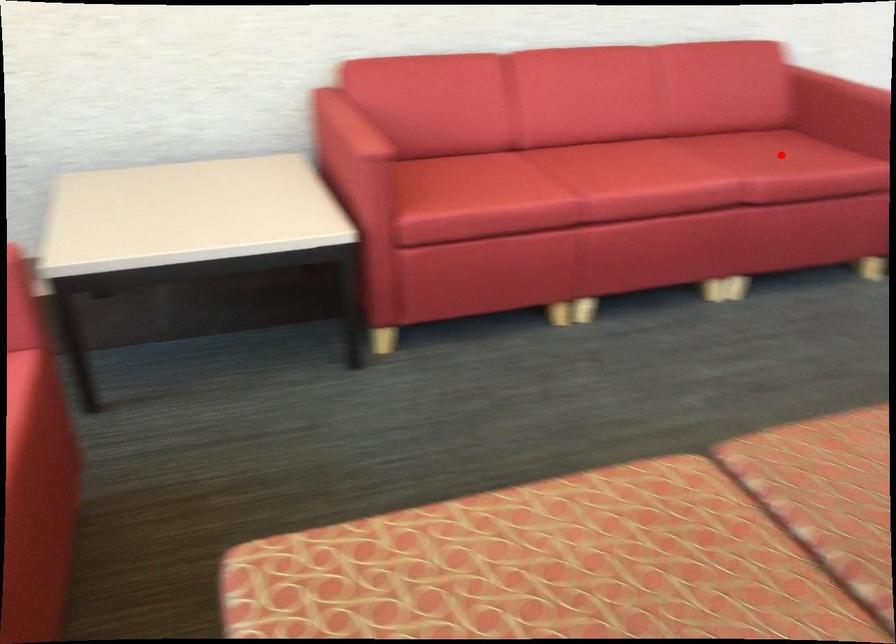
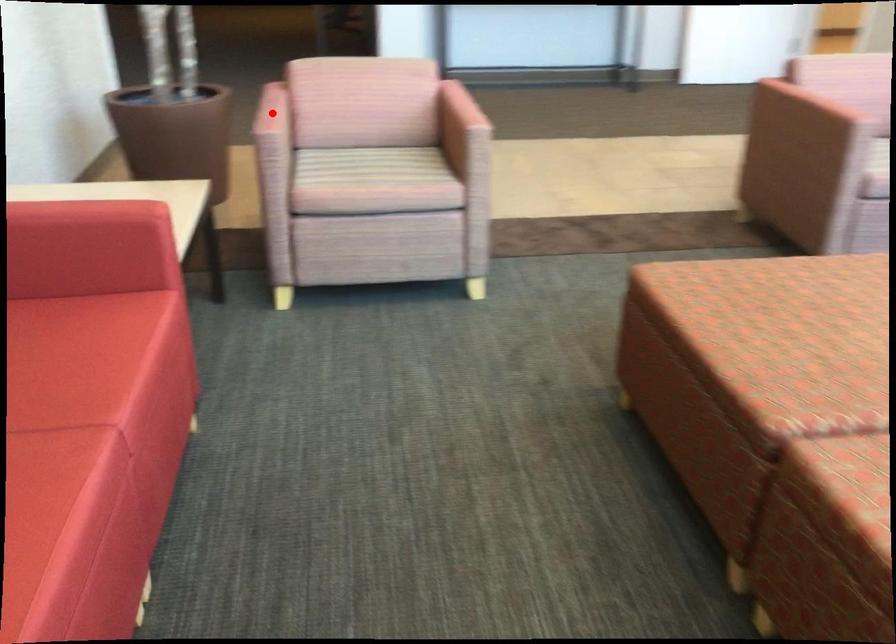
I am providing you with two images of the same scene from different viewpoints. A red point is marked on the first image and another point is marked on the second image. Are the points marked in image1 and image2 representing the same 3D position?

No